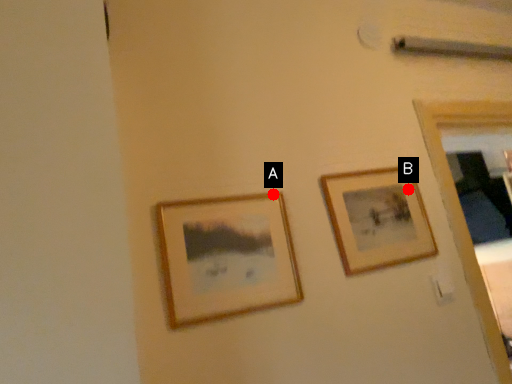
Question: Two points are circled on the image, labeled by A and B beside each circle. Among these points, which one is farthest from the camera?

Choices:
 (A) A is further
 (B) B is further

Answer: (B)